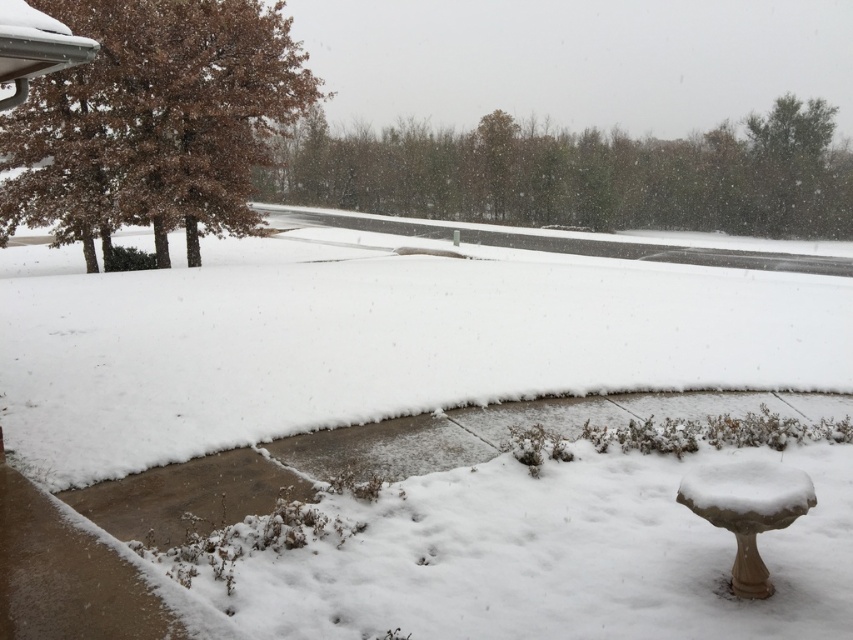
Question: Can you confirm if white fluffy snow at center is positioned to the right of white stone birdbath at lower right?

Choices:
 (A) no
 (B) yes

Answer: (A)

Question: Which point is closer to the camera?

Choices:
 (A) white fluffy snow at center
 (B) white stone birdbath at lower right

Answer: (B)

Question: Which point is farther from the camera taking this photo?

Choices:
 (A) (335, 403)
 (B) (747, 522)

Answer: (A)

Question: Does white fluffy snow at center have a lesser width compared to white stone birdbath at lower right?

Choices:
 (A) yes
 (B) no

Answer: (B)

Question: Is white fluffy snow at center further to the viewer compared to white stone birdbath at lower right?

Choices:
 (A) no
 (B) yes

Answer: (B)